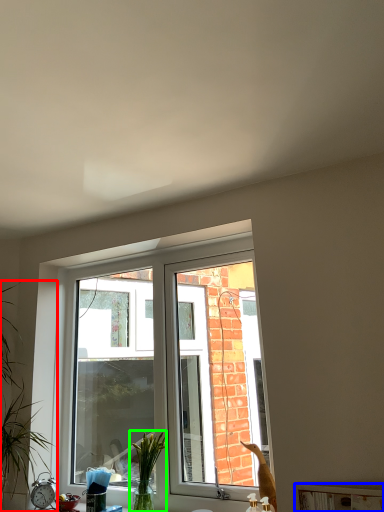
Question: Estimate the real-world distances between objects in this image. Which object is closer to houseplant (highlighted by a red box), window sill (highlighted by a blue box) or plant (highlighted by a green box)?

Choices:
 (A) window sill
 (B) plant

Answer: (B)